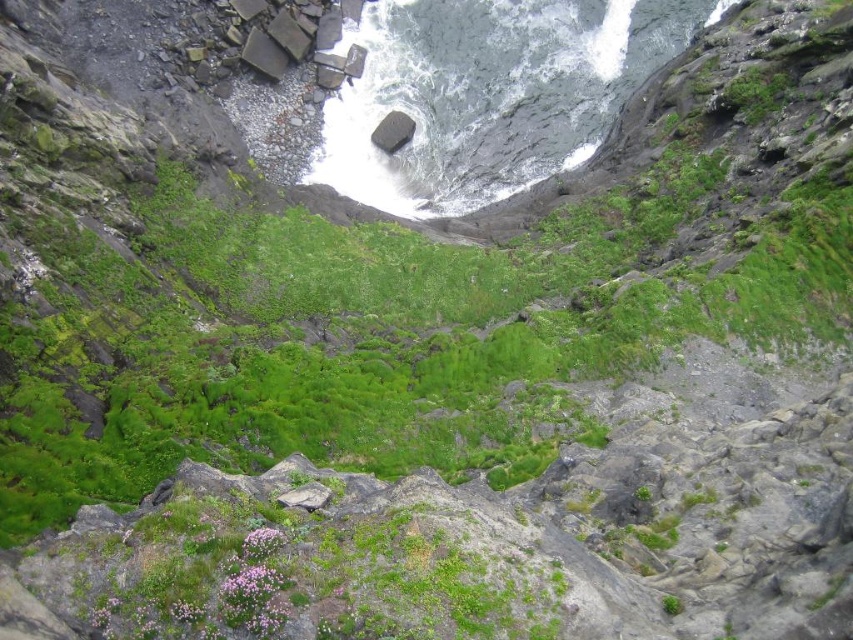
Question: Can you confirm if white frothy water at center is wider than smooth gray rock at center?

Choices:
 (A) yes
 (B) no

Answer: (A)

Question: Which of the following is the farthest from the observer?

Choices:
 (A) (374, 129)
 (B) (316, 157)

Answer: (A)

Question: Which object is positioned closest to the white frothy water at center?

Choices:
 (A) smooth gray rock at center
 (B) gray rough stone at center

Answer: (A)

Question: Which object is farther from the camera taking this photo?

Choices:
 (A) smooth gray rock at center
 (B) white frothy water at center

Answer: (A)

Question: Does white frothy water at center have a greater width compared to smooth gray rock at center?

Choices:
 (A) no
 (B) yes

Answer: (B)

Question: From the image, what is the correct spatial relationship of white frothy water at center in relation to gray rough stone at center?

Choices:
 (A) above
 (B) below

Answer: (A)